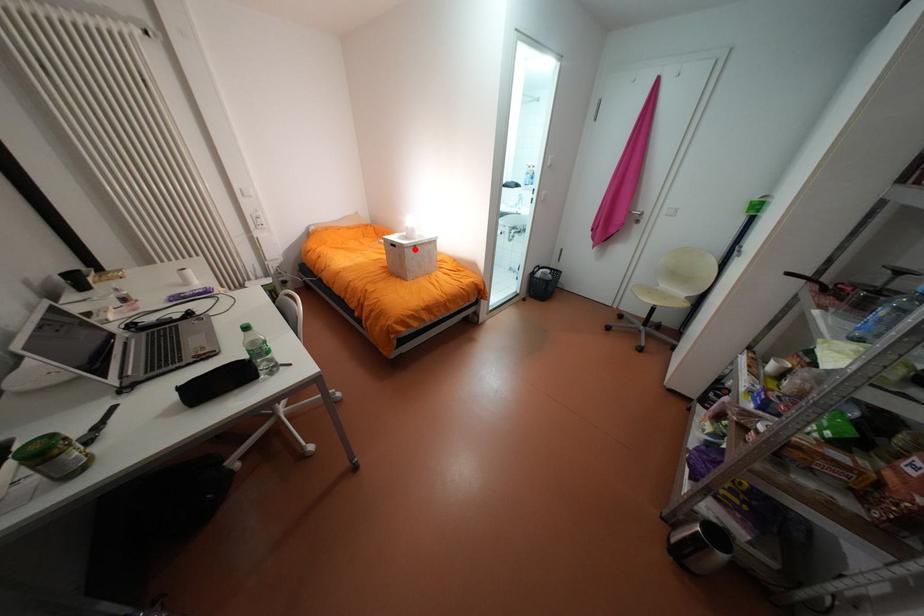
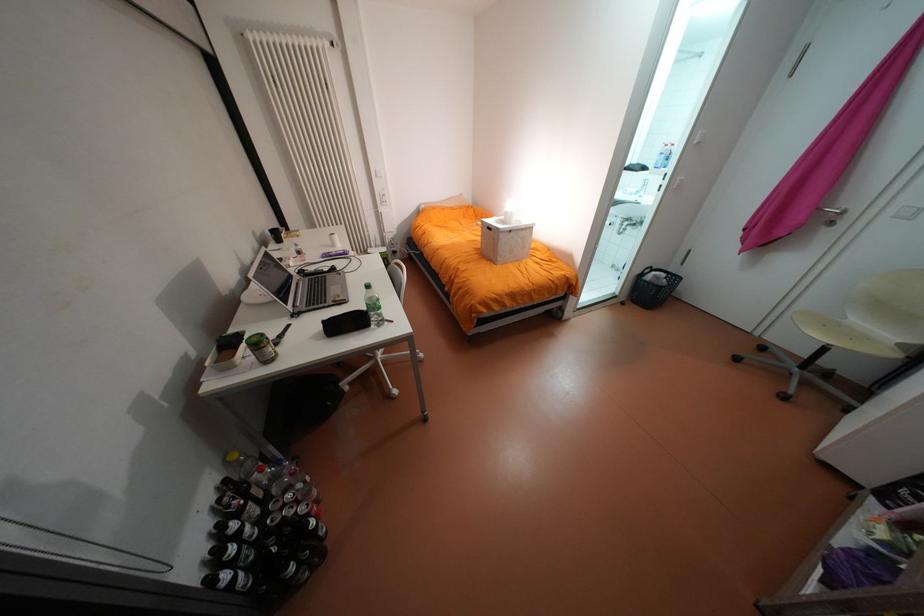
Locate, in the second image, the point that corresponds to the highlighted location in the first image.

(509, 233)